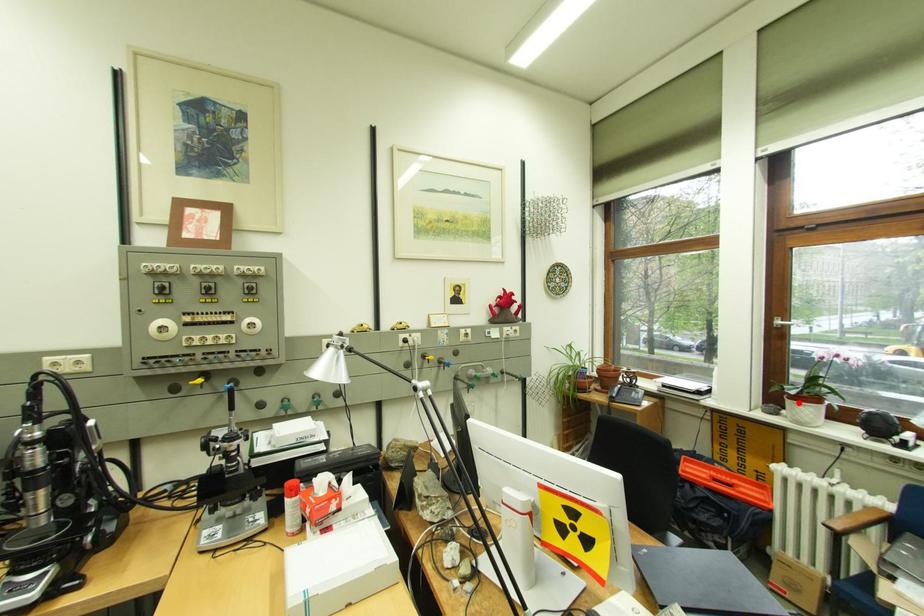
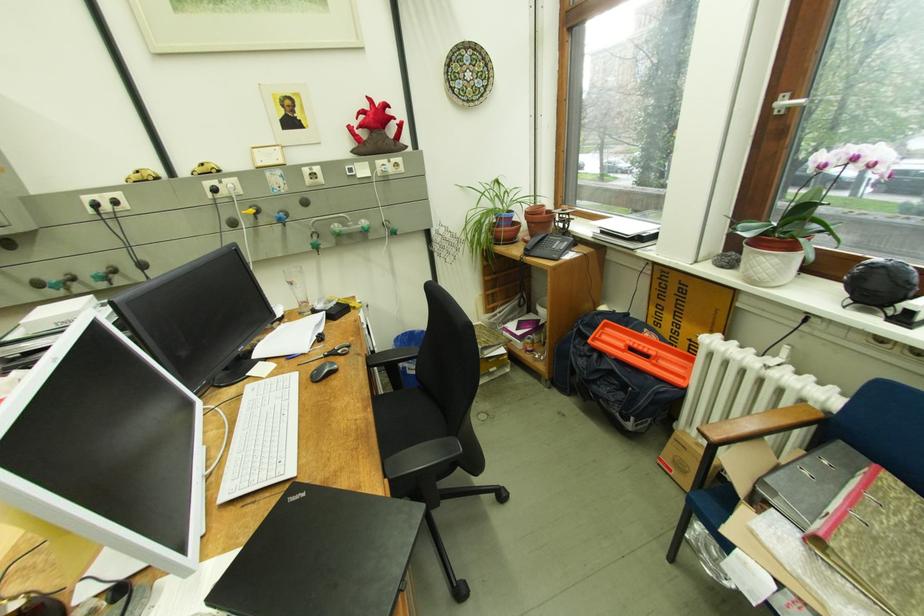
Find the pixel in the second image that matches the highlighted location in the first image.

(758, 249)